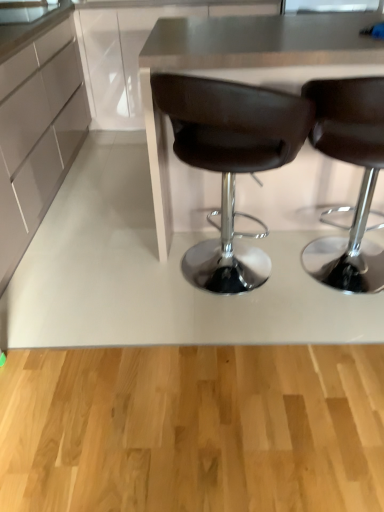
Question: Is matte white cabinet at left surrounding brown leather chair at center, placed as the second chair when sorted from right to left?

Choices:
 (A) no
 (B) yes

Answer: (A)

Question: Can you confirm if matte white cabinet at left is wider than brown leather chair at center, placed as the first chair when sorted from left to right?

Choices:
 (A) yes
 (B) no

Answer: (A)

Question: Considering the relative positions of matte white cabinet at left and brown leather chair at center, placed as the second chair when sorted from right to left, in the image provided, is matte white cabinet at left to the left of brown leather chair at center, placed as the second chair when sorted from right to left, from the viewer's perspective?

Choices:
 (A) yes
 (B) no

Answer: (A)

Question: Can you confirm if matte white cabinet at left is positioned to the right of brown leather chair at center, placed as the first chair when sorted from left to right?

Choices:
 (A) no
 (B) yes

Answer: (A)

Question: From a real-world perspective, is matte white cabinet at left positioned over brown leather chair at center, placed as the first chair when sorted from left to right, based on gravity?

Choices:
 (A) yes
 (B) no

Answer: (A)

Question: Which is correct: matte white cabinet at left is inside metallic gray table at center, or outside of it?

Choices:
 (A) outside
 (B) inside

Answer: (A)

Question: From the image's perspective, is matte white cabinet at left positioned above or below metallic gray table at center?

Choices:
 (A) below
 (B) above

Answer: (B)

Question: From a real-world perspective, is matte white cabinet at left above or below metallic gray table at center?

Choices:
 (A) below
 (B) above

Answer: (B)

Question: In terms of height, does matte white cabinet at left look taller or shorter compared to metallic gray table at center?

Choices:
 (A) short
 (B) tall

Answer: (A)

Question: Is brown leather chair at center, which is the 1th chair from right to left, bigger or smaller than metallic gray table at center?

Choices:
 (A) small
 (B) big

Answer: (A)

Question: Considering the relative positions of brown leather chair at center, placed as the 2th chair when sorted from left to right, and metallic gray table at center in the image provided, is brown leather chair at center, placed as the 2th chair when sorted from left to right, to the left or to the right of metallic gray table at center?

Choices:
 (A) left
 (B) right

Answer: (B)

Question: From a real-world perspective, is brown leather chair at center, placed as the 2th chair when sorted from left to right, positioned above or below metallic gray table at center?

Choices:
 (A) below
 (B) above

Answer: (A)

Question: From the image's perspective, is brown leather chair at center, which is the 1th chair from right to left, positioned above or below metallic gray table at center?

Choices:
 (A) above
 (B) below

Answer: (B)

Question: Do you think brown leather chair at center, which is the 1th chair from right to left, is within matte white cabinet at left, or outside of it?

Choices:
 (A) outside
 (B) inside

Answer: (A)

Question: Would you say brown leather chair at center, which is the 1th chair from right to left, is to the left or to the right of matte white cabinet at left in the picture?

Choices:
 (A) left
 (B) right

Answer: (B)